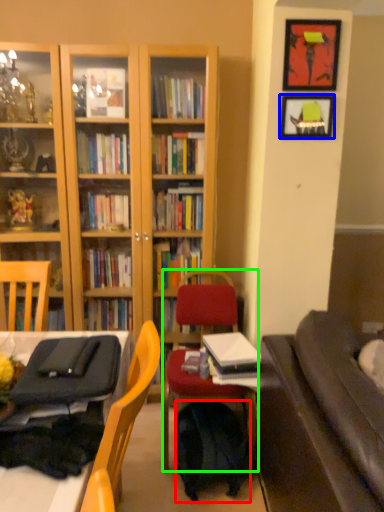
Question: Which is farther away from backpack (highlighted by a red box)? picture frame (highlighted by a blue box) or chair (highlighted by a green box)?

Choices:
 (A) picture frame
 (B) chair

Answer: (A)